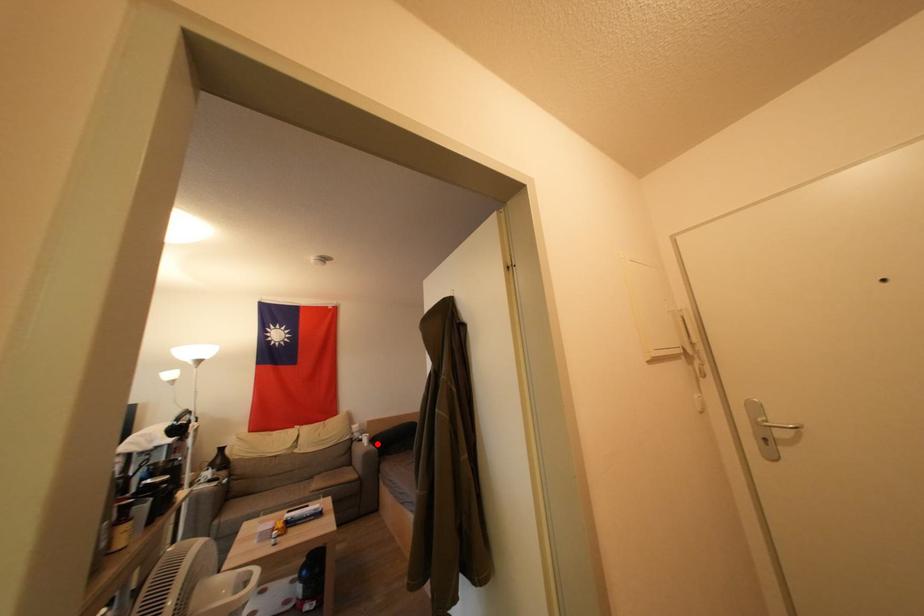
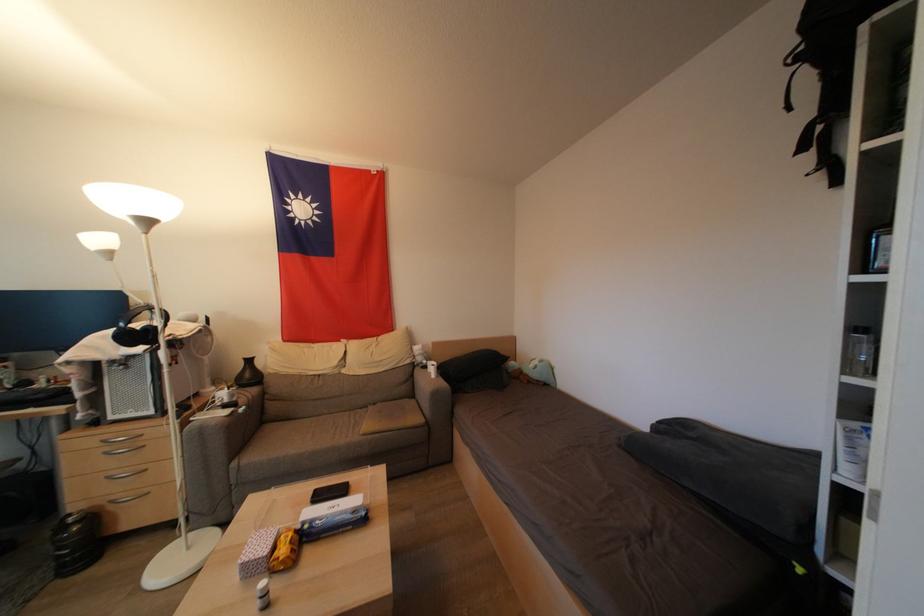
Find the pixel in the second image that matches the highlighted location in the first image.

(445, 373)